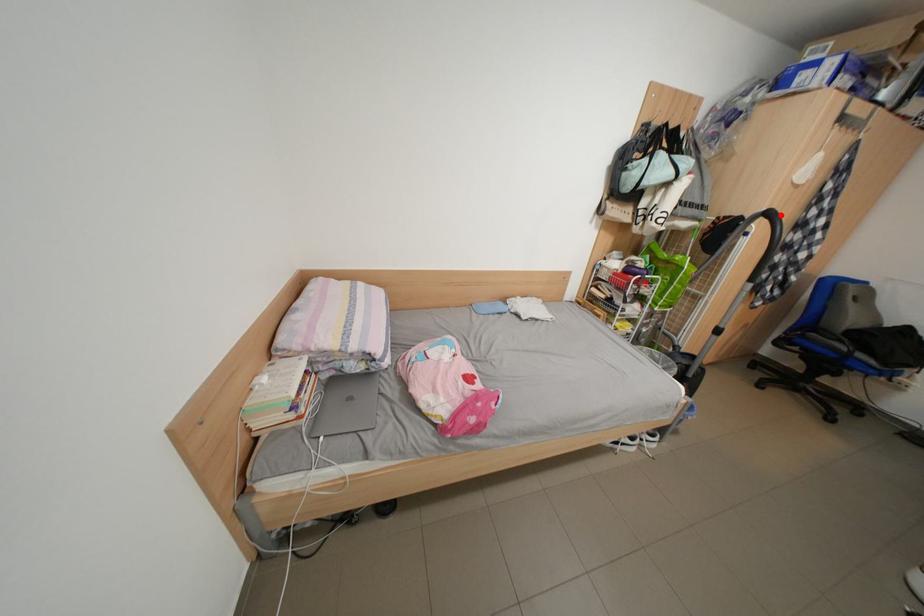
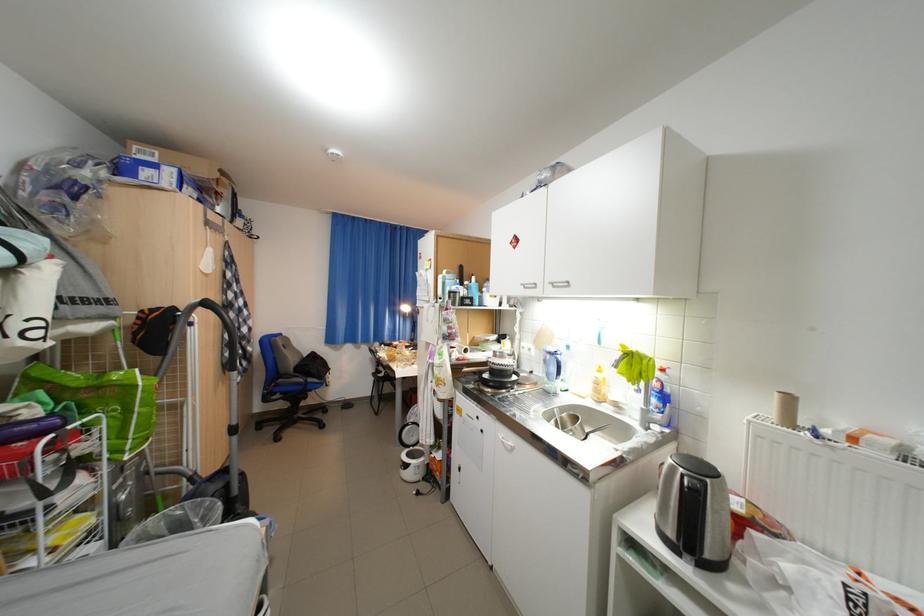
Question: I am providing you with two images of the same scene from different viewpoints. A red point is marked on the first image. Can you still see the location of the red point in image 2?

Choices:
 (A) Yes
 (B) No

Answer: (A)